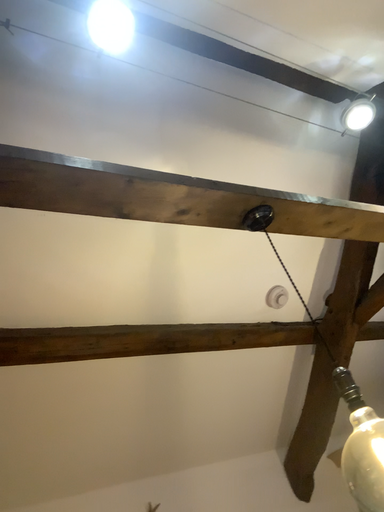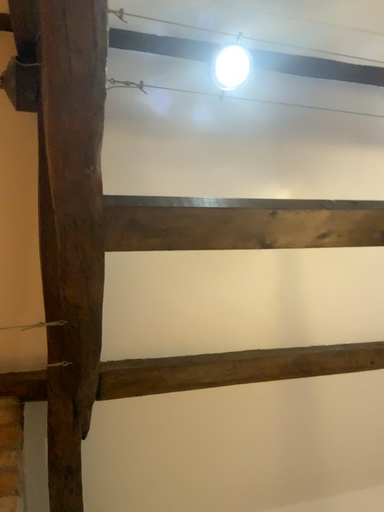
Question: How did the camera likely rotate when shooting the video?

Choices:
 (A) rotated left
 (B) rotated right

Answer: (A)